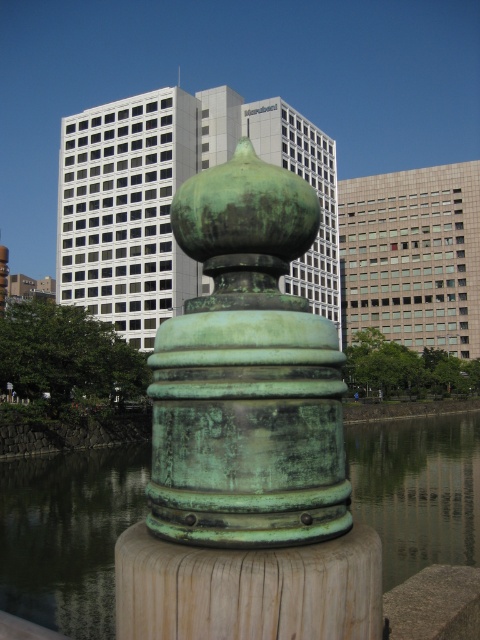
Between green patina cylinder at center and green patina water at center, which one appears on the left side from the viewer's perspective?

From the viewer's perspective, green patina cylinder at center appears more on the left side.

I want to click on green patina cylinder at center, so click(247, 372).

Locate an element on the screen. The height and width of the screenshot is (640, 480). green patina cylinder at center is located at coordinates (247, 372).